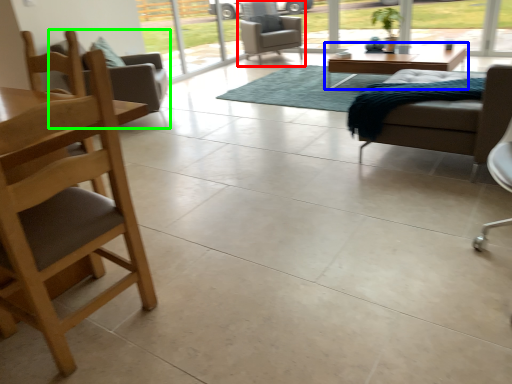
Question: Estimate the real-world distances between objects in this image. Which object is closer to chair (highlighted by a red box), coffee table (highlighted by a blue box) or chair (highlighted by a green box)?

Choices:
 (A) coffee table
 (B) chair

Answer: (A)